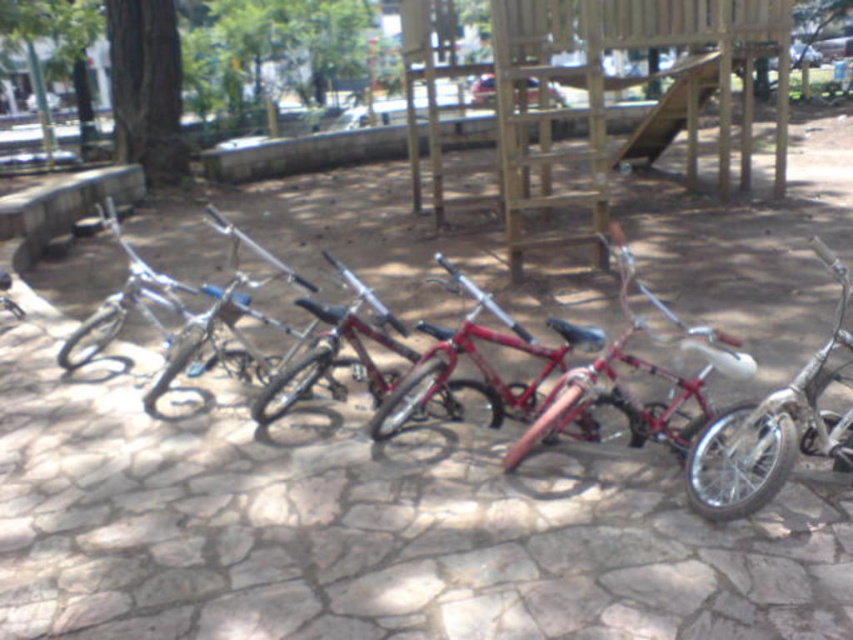
Question: Which of the following is the farthest from the observer?

Choices:
 (A) shiny red bicycle at center
 (B) metallic silver bicycle at center

Answer: (A)

Question: Which object is the closest to the shiny silver bicycle at center?

Choices:
 (A) shiny red bicycle at center
 (B) metallic silver bicycle at center

Answer: (B)

Question: Does metallic silver bicycle at center have a larger size compared to shiny silver bicycle at center?

Choices:
 (A) yes
 (B) no

Answer: (A)

Question: Which of the following is the closest to the observer?

Choices:
 (A) shiny red bicycle at center
 (B) metallic silver bicycle at center
 (C) shiny silver bicycle at center

Answer: (C)

Question: From the image, what is the correct spatial relationship of shiny silver bicycle at center in relation to shiny red bicycle at center?

Choices:
 (A) below
 (B) above

Answer: (B)

Question: Is metallic silver bicycle at center above shiny red bicycle at center?

Choices:
 (A) no
 (B) yes

Answer: (B)